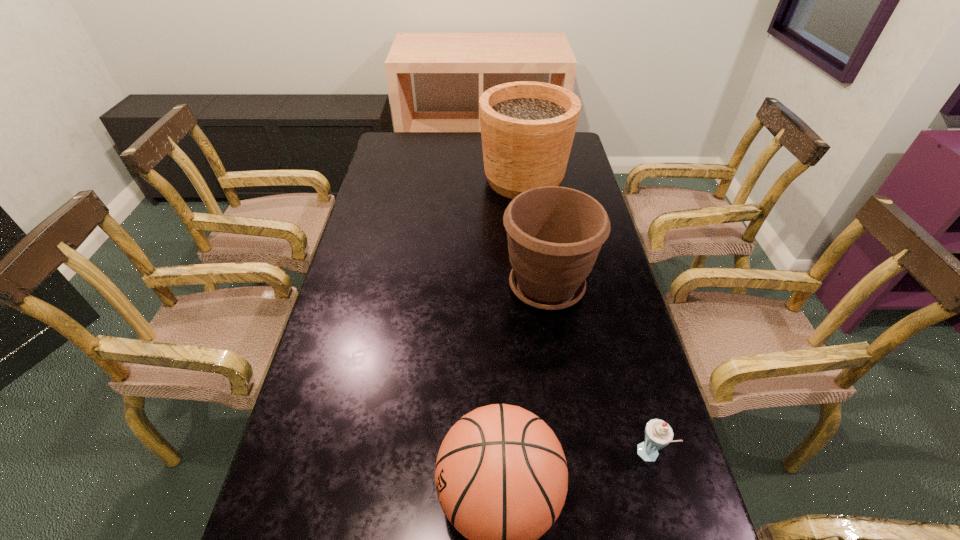
Where is `the third closest object to the third nearest object`? This screenshot has height=540, width=960. the third closest object to the third nearest object is located at coordinates (658, 434).